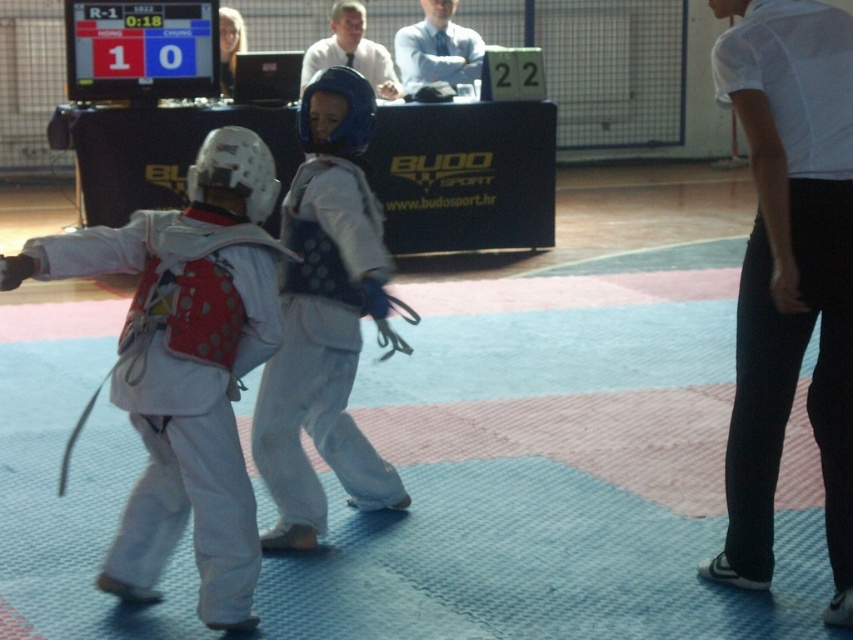
Can you confirm if white matte karate uniform at center is bigger than blonde hair at upper center?

Yes, white matte karate uniform at center is bigger than blonde hair at upper center.

Which is in front, point (341, 236) or point (230, 16)?

Point (341, 236)

Where is `white matte karate uniform at center`? The width and height of the screenshot is (853, 640). white matte karate uniform at center is located at coordinates 325,320.

In the scene shown: Between white matte karate uniform at left and white matte karate uniform at center, which one appears on the left side from the viewer's perspective?

From the viewer's perspective, white matte karate uniform at left appears more on the left side.

Who is lower down, white matte karate uniform at left or white matte karate uniform at center?

white matte karate uniform at left is lower down.

Is point (184, 484) positioned after point (300, 428)?

No, it is not.

Where is `white matte karate uniform at left`? Image resolution: width=853 pixels, height=640 pixels. white matte karate uniform at left is located at coordinates (186, 365).

Which of these two, white smooth shirt at upper right or white matte karate uniform at center, stands taller?

white smooth shirt at upper right is taller.

Between white smooth shirt at upper right and white matte karate uniform at center, which one is positioned higher?

white smooth shirt at upper right

The width and height of the screenshot is (853, 640). Find the location of `white smooth shirt at upper right`. white smooth shirt at upper right is located at coordinates (790, 275).